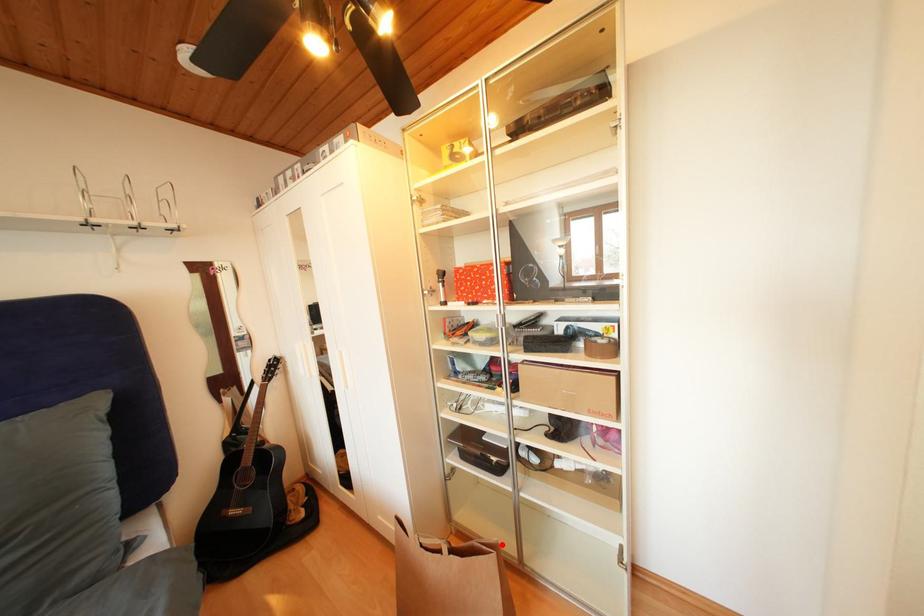
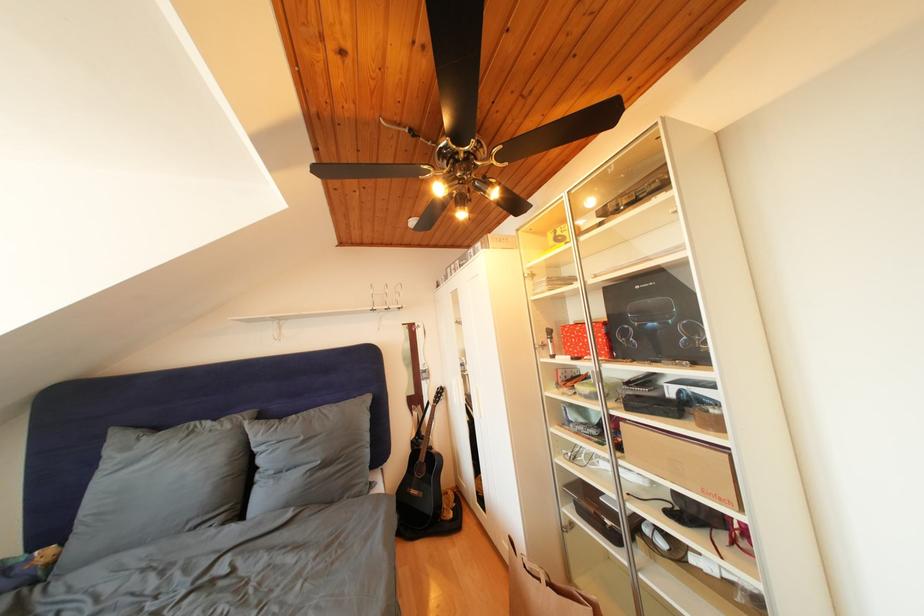
Locate, in the second image, the point that corresponds to the highlighted location in the first image.

(602, 602)